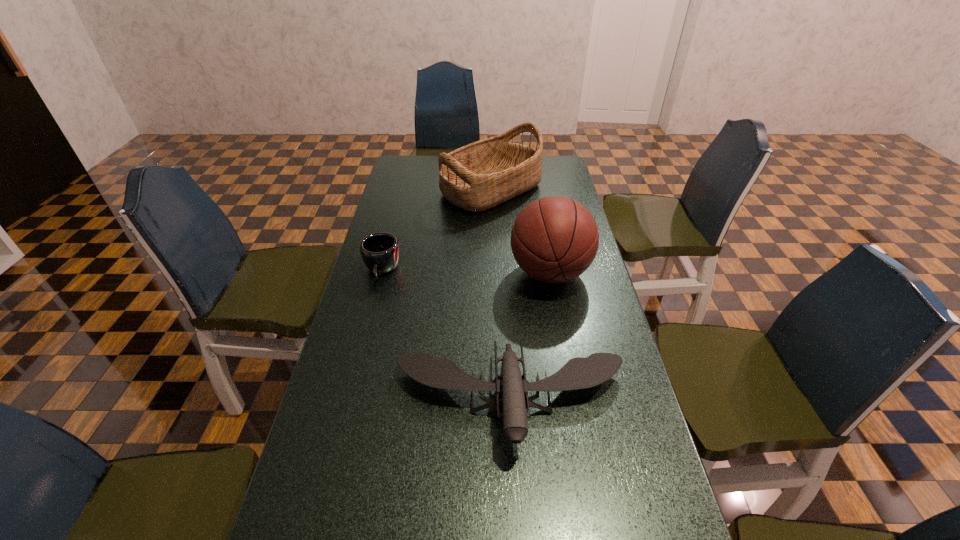
In order to click on the tallest object in this screenshot , I will do `click(554, 239)`.

Locate an element on the screen. The image size is (960, 540). basket is located at coordinates (481, 175).

You are a GUI agent. You are given a task and a screenshot of the screen. Output one action in this format:
    pyautogui.click(x=<x>, y=<y>)
    Task: Click on the farthest object
    Image resolution: width=960 pixels, height=540 pixels.
    Given the screenshot: What is the action you would take?
    pyautogui.click(x=481, y=175)

Where is `the nearest object`? The height and width of the screenshot is (540, 960). the nearest object is located at coordinates (578, 373).

Identify the location of mug. Image resolution: width=960 pixels, height=540 pixels. (380, 251).

This screenshot has height=540, width=960. In order to click on vacant space positioned on the left of the tallest object in this screenshot , I will do `click(386, 273)`.

Locate an element on the screen. vacant region located on the front of the third shortest object is located at coordinates (494, 275).

In order to click on free space located at the head of the nearest object in this screenshot , I will do `click(516, 497)`.

You are a GUI agent. You are given a task and a screenshot of the screen. Output one action in this format:
    pyautogui.click(x=<x>, y=<y>)
    Task: Click on the blank area located on the side of the mug with the handle
    Image resolution: width=960 pixels, height=540 pixels.
    Given the screenshot: What is the action you would take?
    pyautogui.click(x=362, y=349)

In order to click on object that is at the far edge in this screenshot , I will do `click(481, 175)`.